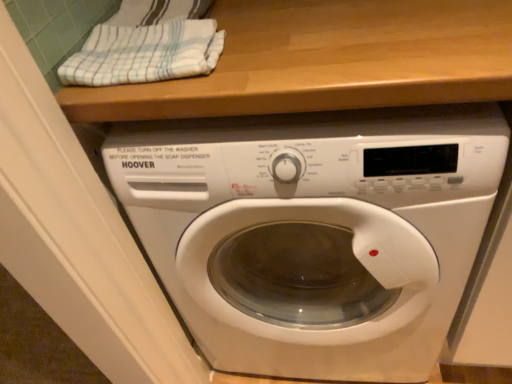
Where is `free space to the right of white striped towel at upper left`? Image resolution: width=512 pixels, height=384 pixels. free space to the right of white striped towel at upper left is located at coordinates (267, 33).